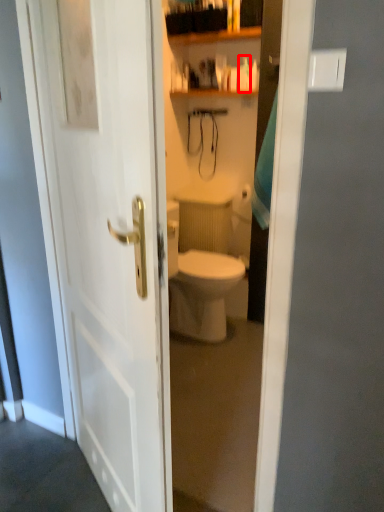
Question: From the image's perspective, where is toiletry (annotated by the red box) located relative to glass door?

Choices:
 (A) below
 (B) above

Answer: (B)